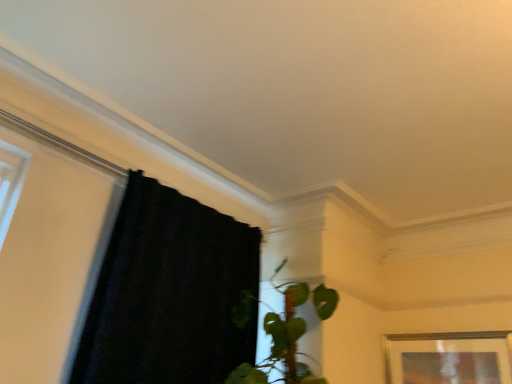
At what (x,y) coordinates should I click in order to perform the action: click on wooden picture frame at lower right. Please return your answer as a coordinate pair (x, y). This screenshot has height=384, width=512. Looking at the image, I should click on (448, 358).

What do you see at coordinates (448, 358) in the screenshot? This screenshot has height=384, width=512. I see `wooden picture frame at lower right` at bounding box center [448, 358].

What are the coordinates of `black fabric curtain at left` in the screenshot? It's located at (169, 293).

This screenshot has height=384, width=512. What do you see at coordinates (169, 293) in the screenshot?
I see `black fabric curtain at left` at bounding box center [169, 293].

Measure the distance between black fabric curtain at left and camera.

The distance of black fabric curtain at left from camera is 5.12 feet.

Locate an element on the screen. wooden picture frame at lower right is located at coordinates (448, 358).

Is wooden picture frame at lower right at the left side of black fabric curtain at left?

No, wooden picture frame at lower right is not to the left of black fabric curtain at left.

Is wooden picture frame at lower right further to camera compared to black fabric curtain at left?

Yes, it is.

Considering the positions of point (391, 341) and point (135, 176), is point (391, 341) closer or farther from the camera than point (135, 176)?

Clearly, point (391, 341) is more distant from the camera than point (135, 176).

From the image's perspective, is wooden picture frame at lower right above or below black fabric curtain at left?

From the image's perspective, wooden picture frame at lower right appears below black fabric curtain at left.

From a real-world perspective, which object rests below the other?

From a 3D spatial view, wooden picture frame at lower right is below.

Does wooden picture frame at lower right have a lesser width compared to black fabric curtain at left?

Yes, wooden picture frame at lower right is thinner than black fabric curtain at left.

Does wooden picture frame at lower right have a greater height compared to black fabric curtain at left?

Incorrect, the height of wooden picture frame at lower right is not larger of that of black fabric curtain at left.

Can you confirm if wooden picture frame at lower right is smaller than black fabric curtain at left?

Yes, wooden picture frame at lower right is smaller than black fabric curtain at left.

Is wooden picture frame at lower right outside of black fabric curtain at left?

Yes.

Is wooden picture frame at lower right not near black fabric curtain at left?

Absolutely, wooden picture frame at lower right is distant from black fabric curtain at left.

Is wooden picture frame at lower right aimed at black fabric curtain at left?

Yes, wooden picture frame at lower right is turned towards black fabric curtain at left.

Locate an element on the screen. picture frame below the black fabric curtain at left (from the image's perspective) is located at coordinates (448, 358).

Visually, is black fabric curtain at left positioned to the left or to the right of wooden picture frame at lower right?

In the image, black fabric curtain at left appears on the left side of wooden picture frame at lower right.

Is black fabric curtain at left in front of wooden picture frame at lower right?

Yes.

Is point (113, 323) closer or farther from the camera than point (407, 365)?

Point (113, 323) is positioned closer to the camera compared to point (407, 365).

From the image's perspective, is black fabric curtain at left above wooden picture frame at lower right?

Yes, from the image's perspective, black fabric curtain at left is above wooden picture frame at lower right.

From a real-world perspective, who is located higher, black fabric curtain at left or wooden picture frame at lower right?

From a 3D spatial view, black fabric curtain at left is above.

Which object is wider, black fabric curtain at left or wooden picture frame at lower right?

black fabric curtain at left.

Considering the relative sizes of black fabric curtain at left and wooden picture frame at lower right in the image provided, is black fabric curtain at left shorter than wooden picture frame at lower right?

In fact, black fabric curtain at left may be taller than wooden picture frame at lower right.

Is black fabric curtain at left bigger or smaller than wooden picture frame at lower right?

In the image, black fabric curtain at left appears to be larger than wooden picture frame at lower right.

Is wooden picture frame at lower right inside black fabric curtain at left?

No.

Is black fabric curtain at left not near wooden picture frame at lower right?

black fabric curtain at left is far away from wooden picture frame at lower right.

Is black fabric curtain at left oriented away from wooden picture frame at lower right?

No, black fabric curtain at left is not facing away from wooden picture frame at lower right.

What's the angular difference between black fabric curtain at left and wooden picture frame at lower right's facing directions?

The angular difference between black fabric curtain at left and wooden picture frame at lower right is 96.6 degrees.

Where is `curtain in front of the wooden picture frame at lower right`? This screenshot has width=512, height=384. curtain in front of the wooden picture frame at lower right is located at coordinates (169, 293).

Locate an element on the screen. This screenshot has width=512, height=384. picture frame beneath the black fabric curtain at left (from a real-world perspective) is located at coordinates (448, 358).

Where is `picture frame located on the right of black fabric curtain at left`? The height and width of the screenshot is (384, 512). picture frame located on the right of black fabric curtain at left is located at coordinates (448, 358).